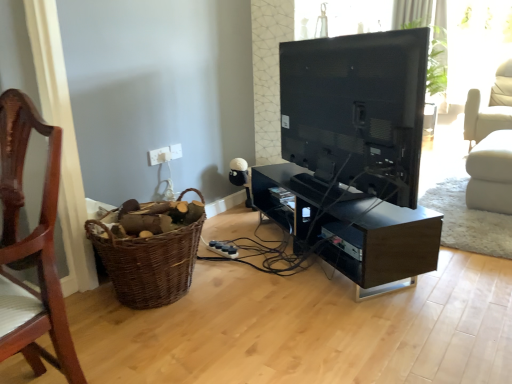
Question: Is white plastic electric outlet at upper center, arranged as the 2th electric outlet when viewed from the left, facing away from wooden chair at left?

Choices:
 (A) no
 (B) yes

Answer: (A)

Question: Is white plastic electric outlet at upper center, marked as the first electric outlet in a right-to-left arrangement, in front of wooden chair at left?

Choices:
 (A) yes
 (B) no

Answer: (B)

Question: From the image's perspective, is white plastic electric outlet at upper center, arranged as the 2th electric outlet when viewed from the left, below wooden chair at left?

Choices:
 (A) no
 (B) yes

Answer: (A)

Question: Could wooden chair at left be considered to be inside white plastic electric outlet at upper center, arranged as the 2th electric outlet when viewed from the left?

Choices:
 (A) yes
 (B) no

Answer: (B)

Question: Is white plastic electric outlet at upper center, arranged as the 2th electric outlet when viewed from the left, next to wooden chair at left?

Choices:
 (A) yes
 (B) no

Answer: (B)

Question: Does white plastic electric outlet at upper center, arranged as the 2th electric outlet when viewed from the left, come behind wooden chair at left?

Choices:
 (A) yes
 (B) no

Answer: (A)

Question: Is white fabric swivel chair at right positioned before white plastic electric outlet at upper center, arranged as the 2th electric outlet when viewed from the left?

Choices:
 (A) no
 (B) yes

Answer: (A)

Question: Considering the relative sizes of white fabric swivel chair at right and white plastic electric outlet at upper center, marked as the first electric outlet in a right-to-left arrangement, in the image provided, is white fabric swivel chair at right shorter than white plastic electric outlet at upper center, marked as the first electric outlet in a right-to-left arrangement,?

Choices:
 (A) yes
 (B) no

Answer: (B)

Question: From a real-world perspective, is white fabric swivel chair at right on white plastic electric outlet at upper center, marked as the first electric outlet in a right-to-left arrangement?

Choices:
 (A) no
 (B) yes

Answer: (A)

Question: Considering the relative sizes of white fabric swivel chair at right and white plastic electric outlet at upper center, marked as the first electric outlet in a right-to-left arrangement, in the image provided, is white fabric swivel chair at right thinner than white plastic electric outlet at upper center, marked as the first electric outlet in a right-to-left arrangement,?

Choices:
 (A) no
 (B) yes

Answer: (A)

Question: Are white fabric swivel chair at right and white plastic electric outlet at upper center, marked as the first electric outlet in a right-to-left arrangement, located far from each other?

Choices:
 (A) no
 (B) yes

Answer: (B)

Question: Considering the relative positions of white fabric swivel chair at right and white plastic electric outlet at upper center, marked as the first electric outlet in a right-to-left arrangement, in the image provided, is white fabric swivel chair at right to the left of white plastic electric outlet at upper center, marked as the first electric outlet in a right-to-left arrangement, from the viewer's perspective?

Choices:
 (A) no
 (B) yes

Answer: (A)

Question: Can you confirm if black glossy tv stand at center is thinner than brown woven basket at lower left?

Choices:
 (A) no
 (B) yes

Answer: (A)